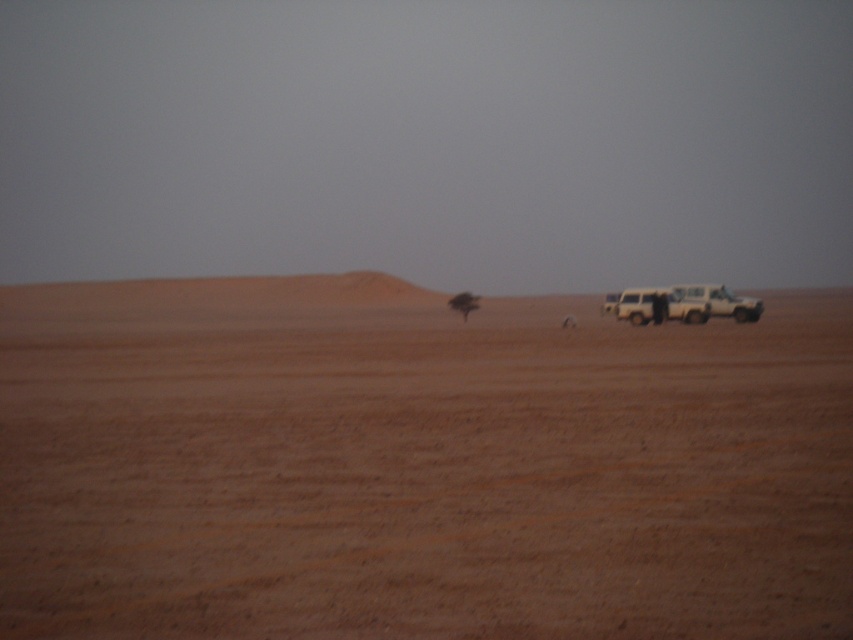
You are a hiker who just arrived at the desert and wants to reach the solitary tree in the distance. You see the brown sandy dirt field at center and the matte white jeep at right. Which direction should you head towards to get closer to the tree?

The brown sandy dirt field at center is to the left of the matte white jeep at right. Since the solitary tree is in the distance, heading towards the direction of the brown sandy dirt field at center would move you closer to the tree as it is positioned between you and the tree.

You are standing in the desert and want to walk towards the matte white jeep at right. Which direction should you head to first? The brown sandy dirt field at center is in your way. Is the jeep behind or in front of the sandy field?

The brown sandy dirt field at center is closer to the viewer than the matte white jeep at right, so the jeep is behind the sandy field.

You are navigating a drone over a desert scene. You need to land the drone precisely at the coordinates given for the brown sandy dirt field at center. What are the coordinates where you should direct the drone to land?

The coordinates for the brown sandy dirt field at center are at point (416, 465), so you should direct the drone to land there.